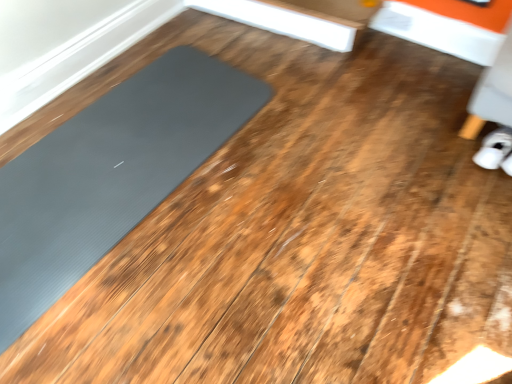
The width and height of the screenshot is (512, 384). I want to click on vacant area on top of gray rubber mat at left (from a real-world perspective), so click(x=116, y=157).